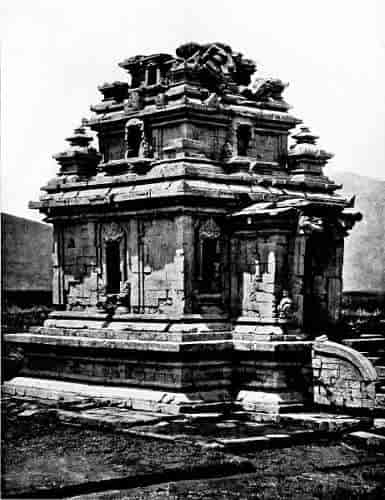
At what (x,y) coordinates should I click in order to perform the action: click on wall. Please return your answer as a coordinate pair (x, y). This screenshot has width=385, height=500. Looking at the image, I should click on (26, 254).